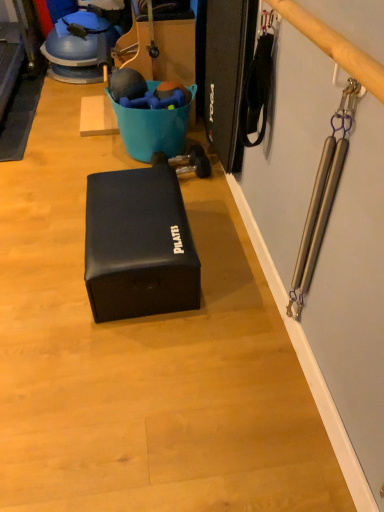
Locate an element on the screen. This screenshot has height=512, width=384. black leather box at center is located at coordinates (139, 245).

What do you see at coordinates (139, 245) in the screenshot? I see `black leather box at center` at bounding box center [139, 245].

What is the approximate width of black leather box at center?

The width of black leather box at center is 17.80 inches.

What do you see at coordinates (19, 117) in the screenshot?
I see `dark blue rubber yoga mat at left` at bounding box center [19, 117].

Identify the location of dark blue rubber yoga mat at left. (19, 117).

In order to click on black leather box at center in this screenshot , I will do `click(139, 245)`.

Does black leather box at center appear on the left side of dark blue rubber yoga mat at left?

No, black leather box at center is not to the left of dark blue rubber yoga mat at left.

Is black leather box at center in front of or behind dark blue rubber yoga mat at left in the image?

black leather box at center is in front of dark blue rubber yoga mat at left.

Which is in front, point (159, 243) or point (21, 141)?

The point (159, 243) is closer.

From the image's perspective, does black leather box at center appear lower than dark blue rubber yoga mat at left?

Indeed, from the image's perspective, black leather box at center is shown beneath dark blue rubber yoga mat at left.

From a real-world perspective, relative to dark blue rubber yoga mat at left, is black leather box at center vertically above or below?

black leather box at center is above dark blue rubber yoga mat at left.

Which object is wider, black leather box at center or dark blue rubber yoga mat at left?

Wider between the two is dark blue rubber yoga mat at left.

Can you confirm if black leather box at center is taller than dark blue rubber yoga mat at left?

Yes.

Who is smaller, black leather box at center or dark blue rubber yoga mat at left?

dark blue rubber yoga mat at left.

Is black leather box at center outside of dark blue rubber yoga mat at left?

Indeed, black leather box at center is completely outside dark blue rubber yoga mat at left.

Is black leather box at center directly adjacent to dark blue rubber yoga mat at left?

No, black leather box at center is not in contact with dark blue rubber yoga mat at left.

Is black leather box at center turned away from dark blue rubber yoga mat at left?

No, dark blue rubber yoga mat at left is not at the back of black leather box at center.

What's the angular difference between black leather box at center and dark blue rubber yoga mat at left's facing directions?

The angle between the facing direction of black leather box at center and the facing direction of dark blue rubber yoga mat at left is 91 degrees.

Measure the distance from black leather box at center to dark blue rubber yoga mat at left.

black leather box at center and dark blue rubber yoga mat at left are 1.28 meters apart.

Locate an element on the screen. The width and height of the screenshot is (384, 512). box below the dark blue rubber yoga mat at left (from the image's perspective) is located at coordinates (139, 245).

Considering the positions of objects dark blue rubber yoga mat at left and black leather box at center in the image provided, who is more to the right, dark blue rubber yoga mat at left or black leather box at center?

black leather box at center.

Is dark blue rubber yoga mat at left further to camera compared to black leather box at center?

Yes, it is.

Which point is more distant from viewer, (19, 138) or (132, 218)?

The point (19, 138) is more distant.

From the image's perspective, is dark blue rubber yoga mat at left under black leather box at center?

No, from the image's perspective, dark blue rubber yoga mat at left is not beneath black leather box at center.

From a real-world perspective, which is physically below, dark blue rubber yoga mat at left or black leather box at center?

From a 3D spatial view, dark blue rubber yoga mat at left is below.

Between dark blue rubber yoga mat at left and black leather box at center, which one has larger width?

Wider between the two is dark blue rubber yoga mat at left.

Which of these two, dark blue rubber yoga mat at left or black leather box at center, stands shorter?

dark blue rubber yoga mat at left is shorter.

Who is smaller, dark blue rubber yoga mat at left or black leather box at center?

With smaller size is dark blue rubber yoga mat at left.

Is dark blue rubber yoga mat at left inside the boundaries of black leather box at center, or outside?

The correct answer is: outside.

Is dark blue rubber yoga mat at left next to black leather box at center?

No, dark blue rubber yoga mat at left is not next to black leather box at center.

Is dark blue rubber yoga mat at left turned away from black leather box at center?

dark blue rubber yoga mat at left is not turned away from black leather box at center.

How far apart are dark blue rubber yoga mat at left and black leather box at center?

dark blue rubber yoga mat at left is 1.28 meters from black leather box at center.

What are the coordinates of `yoga mat that appears below the black leather box at center (from a real-world perspective)` in the screenshot? It's located at (19, 117).

What are the coordinates of `yoga mat behind the black leather box at center` in the screenshot? It's located at (19, 117).

The width and height of the screenshot is (384, 512). Find the location of `yoga mat located on the left of black leather box at center`. yoga mat located on the left of black leather box at center is located at coordinates (19, 117).